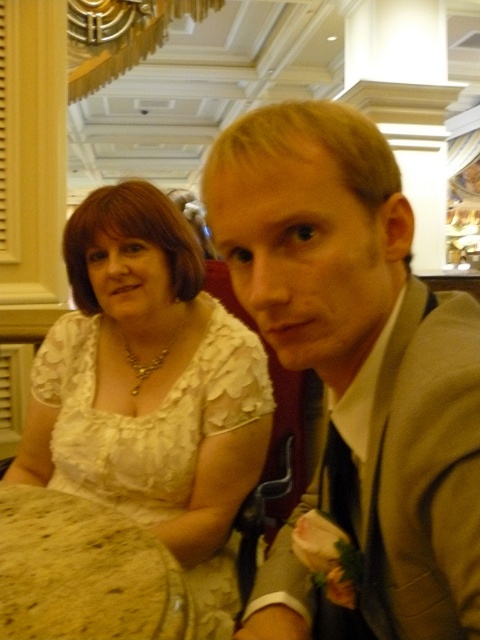
You are a photographer setting up for a formal event. You need to ensure that the satin beige suit at right and the brown speckled stone table at lower left are both visible in the frame. Given their height difference, which object should you adjust the camera angle to focus on to capture both effectively?

The satin beige suit at right is much taller than the brown speckled stone table at lower left. To capture both effectively, you should adjust the camera angle to focus on the taller object, the satin beige suit at right, while ensuring the shorter table is still in view.

You are a photographer at a wedding event. You need to position a camera stand between the white lace dress at left and the brown speckled stone table at lower left. Can the camera stand, which is 1.2 meters wide, fit between them?

The white lace dress at left might be wider than brown speckled stone table at lower left. Since the camera stand is 1.2 meters wide, but the available space between them is uncertain, it is unclear if it will fit. Check the actual distance before placing the stand.